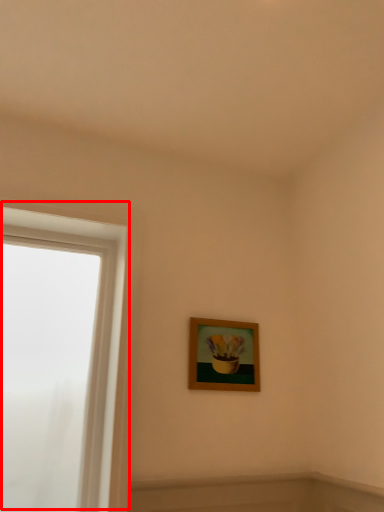
Question: Where is window (annotated by the red box) located in relation to picture frame in the image?

Choices:
 (A) right
 (B) left

Answer: (B)